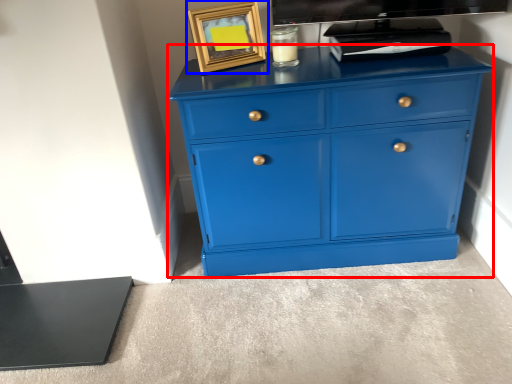
Question: Among these objects, which one is farthest to the camera, chest of drawers (highlighted by a red box) or picture frame (highlighted by a blue box)?

Choices:
 (A) chest of drawers
 (B) picture frame

Answer: (B)